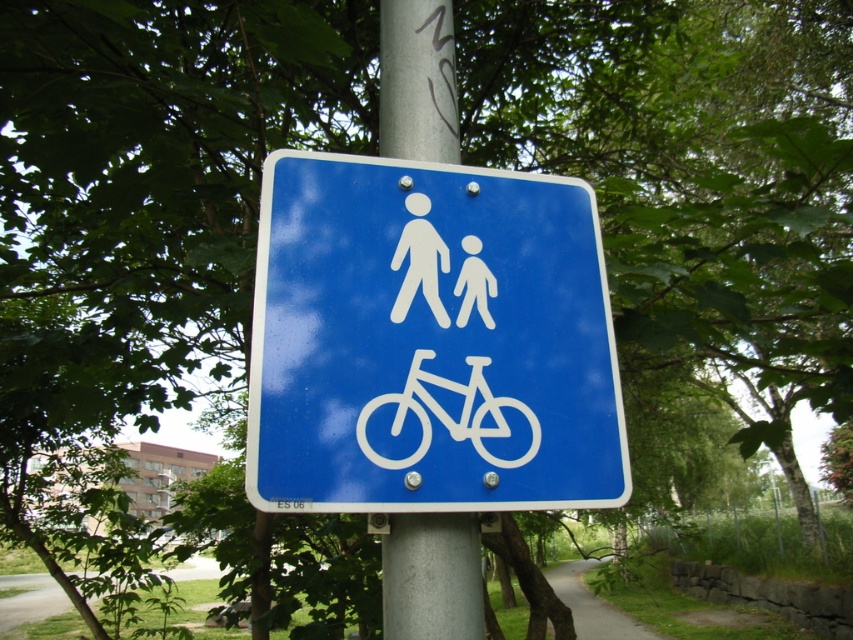
Who is higher up, blue plastic sign at center or white matte figure at center?

Positioned higher is white matte figure at center.

Where is `blue plastic sign at center`? blue plastic sign at center is located at coordinates (428, 340).

Between point (471, 316) and point (440, 317), which one is positioned in front?

Point (440, 317) is in front.

This screenshot has width=853, height=640. I want to click on blue plastic sign at center, so click(x=428, y=340).

Is blue plastic sign at center to the right of silver metallic pole at center from the viewer's perspective?

Correct, you'll find blue plastic sign at center to the right of silver metallic pole at center.

Is blue plastic sign at center in front of silver metallic pole at center?

That is True.

What do you see at coordinates (428, 340) in the screenshot? I see `blue plastic sign at center` at bounding box center [428, 340].

The height and width of the screenshot is (640, 853). Identify the location of blue plastic sign at center. (428, 340).

Where is `white plastic bicycle at center`? The image size is (853, 640). white plastic bicycle at center is located at coordinates (450, 413).

Can you confirm if white plastic bicycle at center is taller than white matte figure at center?

In fact, white plastic bicycle at center may be shorter than white matte figure at center.

Measure the distance between white plastic bicycle at center and camera.

They are 35.83 inches apart.

The width and height of the screenshot is (853, 640). Find the location of `white plastic bicycle at center`. white plastic bicycle at center is located at coordinates (450, 413).